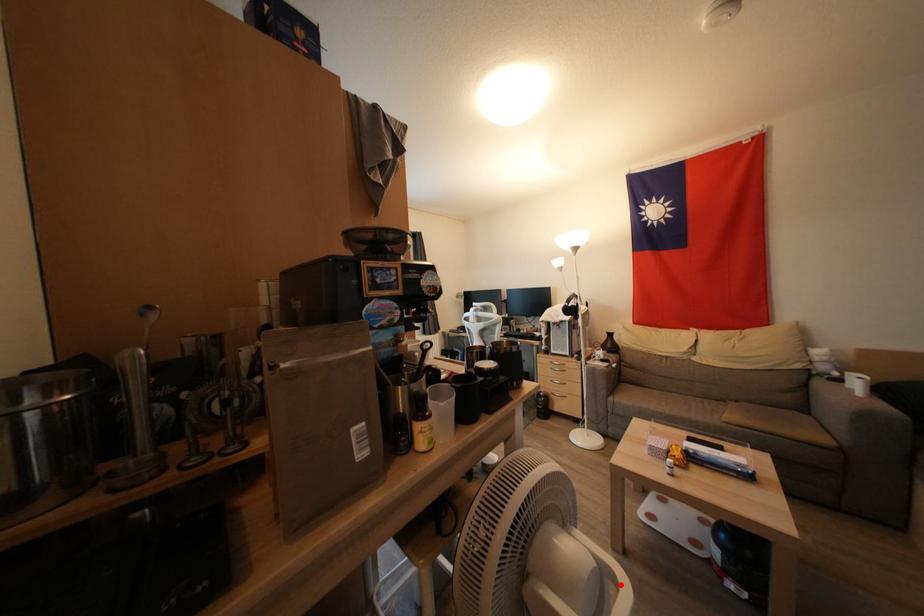
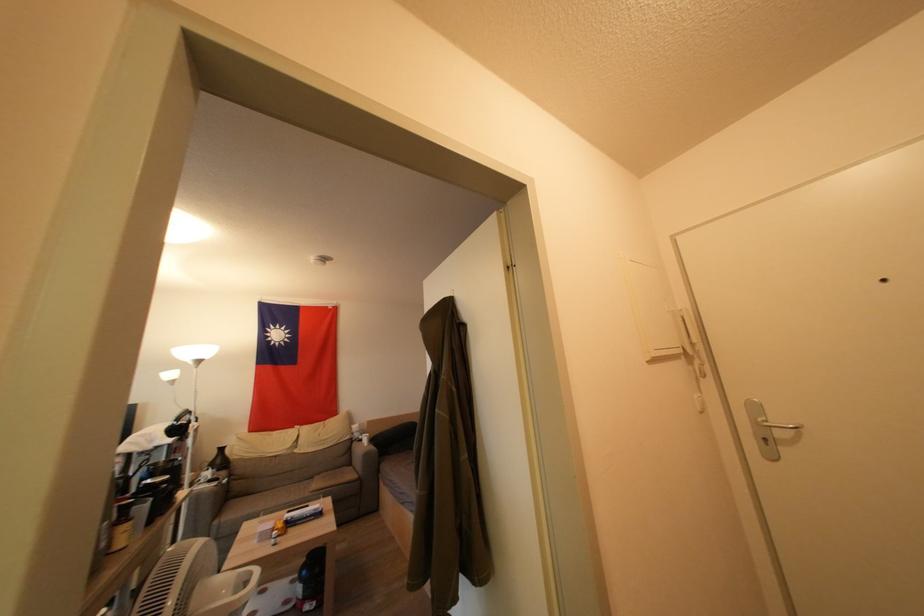
Locate, in the second image, the point that corresponds to the highlighted location in the first image.

(256, 577)